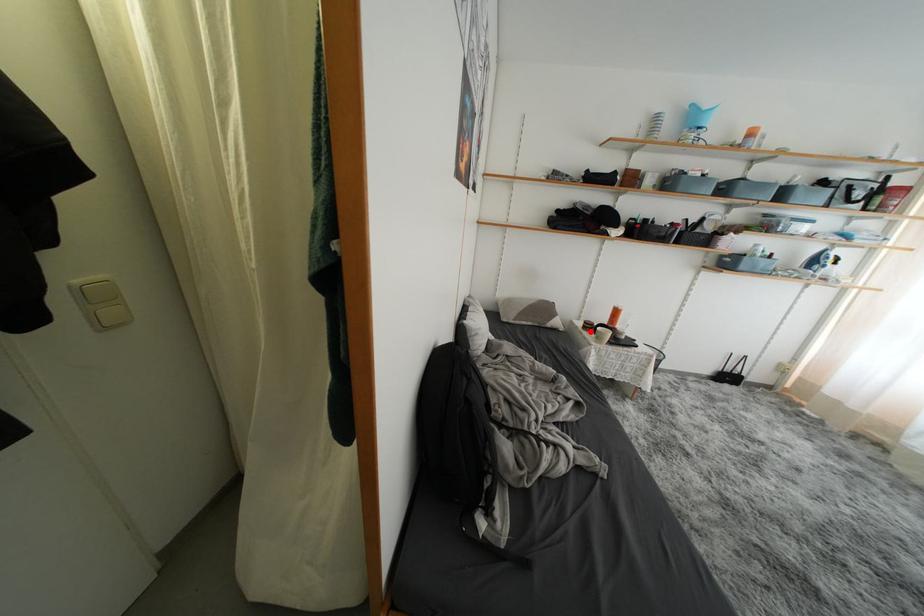
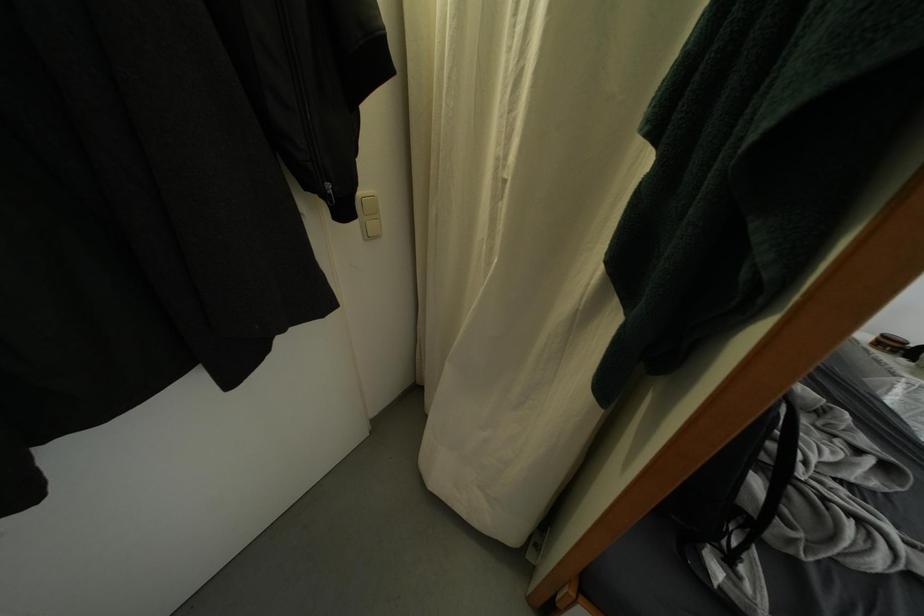
Find the pixel in the second image that matches the highlighted location in the first image.

(884, 347)